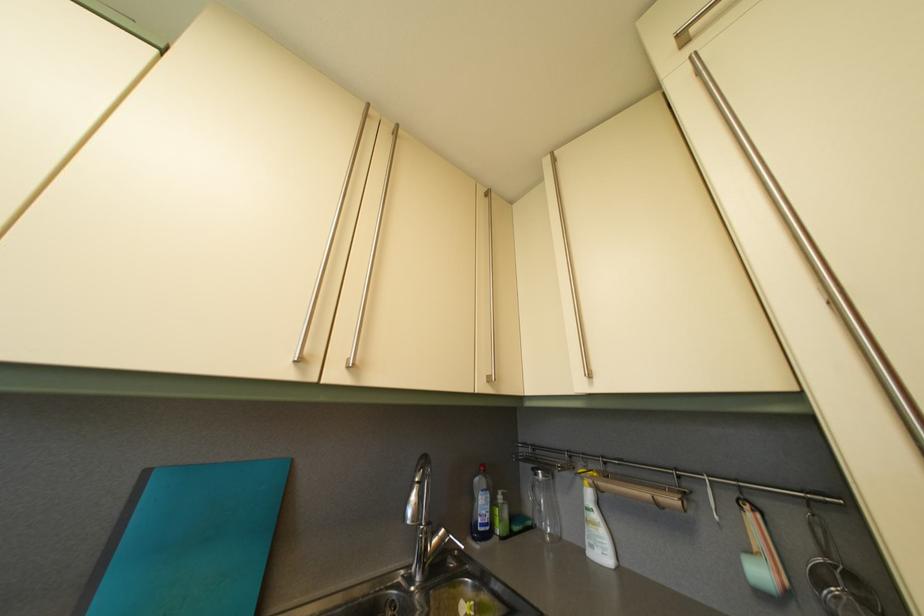
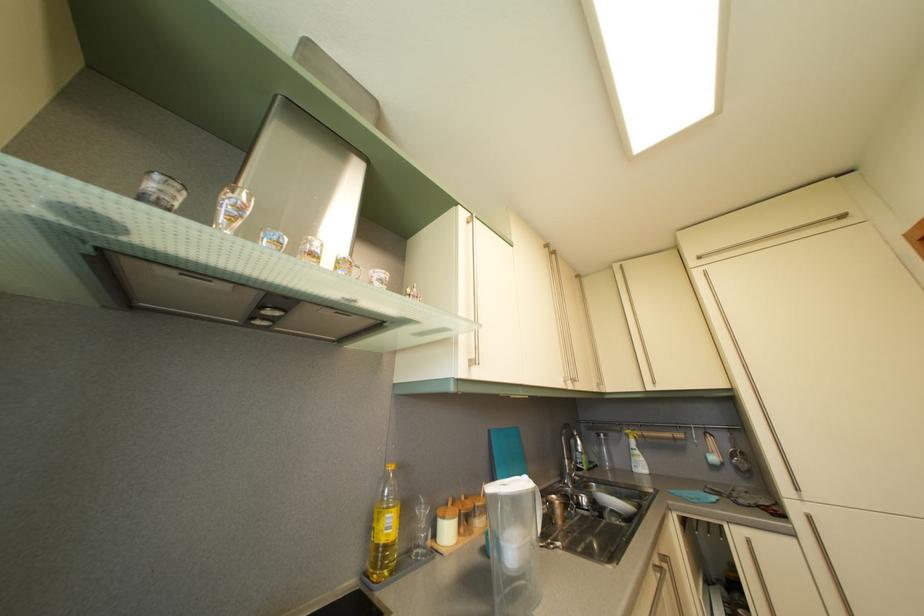
Locate, in the second image, the point that corresponds to point (554, 169) in the first image.

(624, 274)